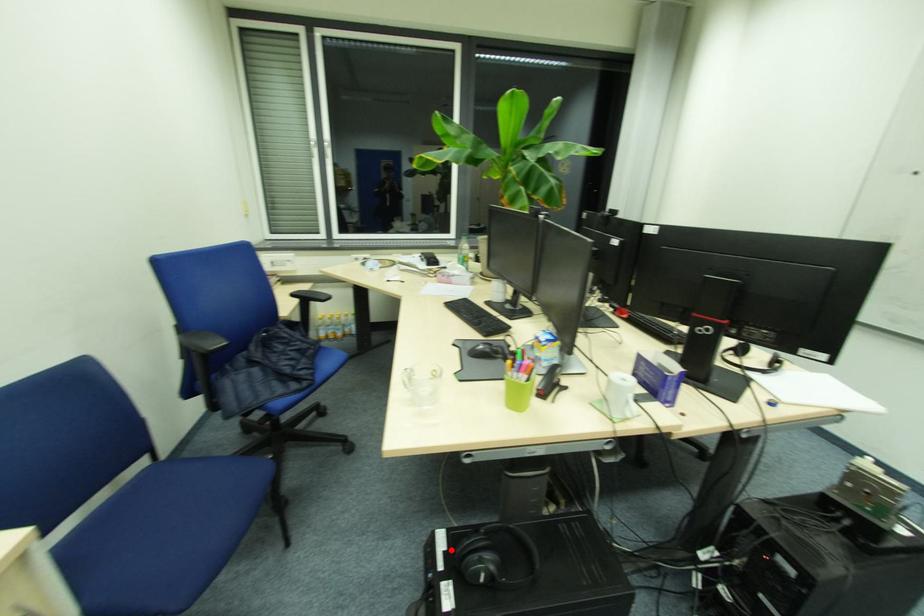
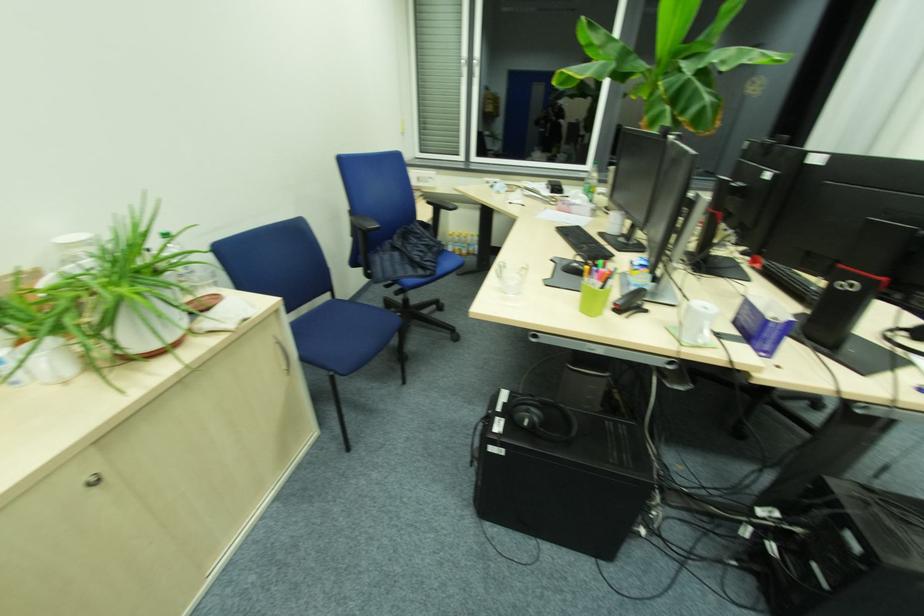
Question: I am providing you with two images of the same scene from different viewpoints. A red point is shown in image1. For the corresponding object point in image2, is it positioned nearer or farther from the camera?

Choices:
 (A) Nearer
 (B) Farther

Answer: (B)